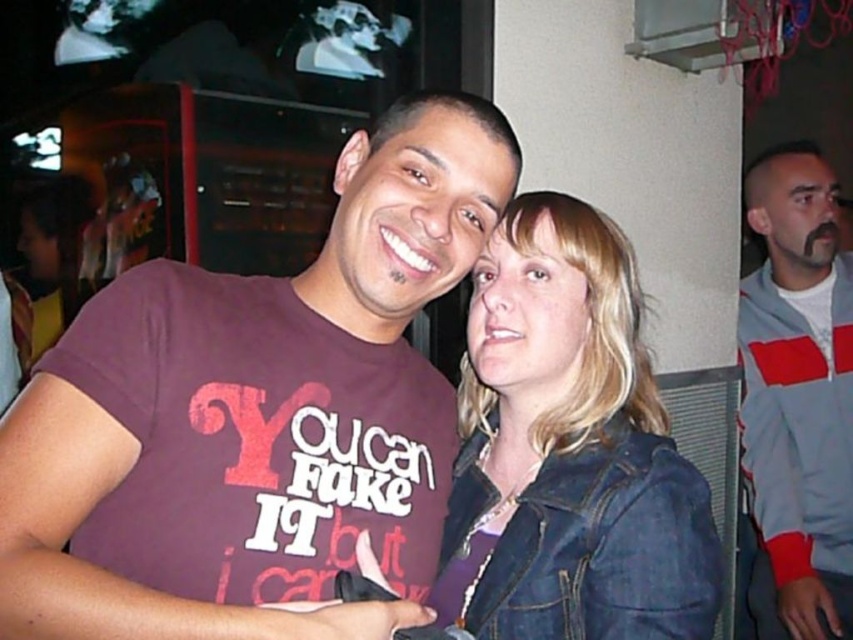
Question: Which object is the closest to the gray/red zip-up jacket at right?

Choices:
 (A) purple cotton t-shirt at center
 (B) denim jacket at center

Answer: (B)

Question: Which point is farther from the camera taking this photo?

Choices:
 (A) (637, 634)
 (B) (390, 196)

Answer: (B)

Question: Can you confirm if purple cotton t-shirt at center is positioned below denim jacket at center?

Choices:
 (A) yes
 (B) no

Answer: (B)

Question: Can you confirm if denim jacket at center is positioned to the right of gray/red zip-up jacket at right?

Choices:
 (A) yes
 (B) no

Answer: (B)

Question: Among these points, which one is nearest to the camera?

Choices:
 (A) (827, 465)
 (B) (576, 449)

Answer: (B)

Question: Considering the relative positions of purple cotton t-shirt at center and denim jacket at center in the image provided, where is purple cotton t-shirt at center located with respect to denim jacket at center?

Choices:
 (A) right
 (B) left

Answer: (B)